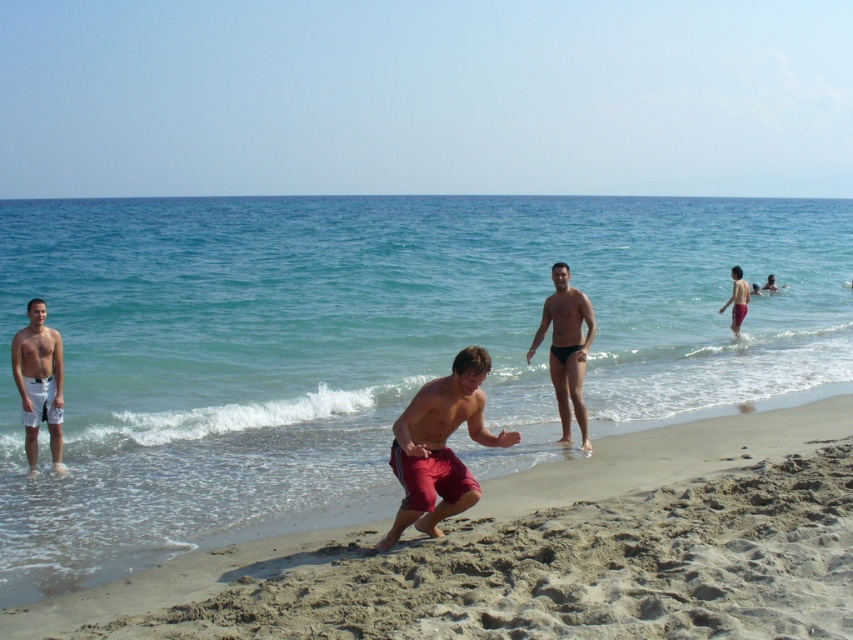
You are a photographer trying to capture a photo of the smooth black swim trunks at center and the red fabric shorts at right. Based on their heights, which one should you focus on first to ensure both are in frame?

The smooth black swim trunks at center is taller than the red fabric shorts at right, so you should focus on the smooth black swim trunks at center first to ensure both are in frame.

You are a photographer trying to capture a candid shot of the two men on the beach. The smooth black swim trunks at center and the red fabric shorts at right are your subjects. Since you want to ensure both are in focus, which subject should you focus on first to maximize depth of field?

The smooth black swim trunks at center is thinner than red fabric shorts at right, so focusing on the closer subject, the smooth black swim trunks at center, will allow both to be in focus due to the depth of field extending further behind the point of focus.

You are standing at the beach and want to take a photo of both the point at (453, 380) and the point at (744, 310). Which point should you focus on first to ensure both are in the same frame?

You should focus on the point at (453, 380) first because it is closer to the camera than the point at (744, 310). By focusing on the closer point, the farther point will also be within the depth of field and in focus.